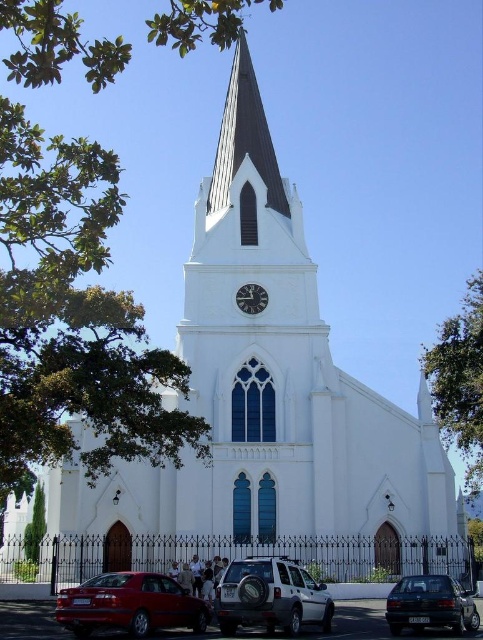
Based on the photo, you are standing at the shiny red sedan at lower left and want to walk directly to the metallic clock face at center. How many steps would you need to take if each step is about 2.5 feet long?

The distance between the shiny red sedan at lower left and the metallic clock face at center is 132.25 feet. Dividing this by the step length of 2.5 feet gives approximately 52.9 steps. Since you can only take whole steps, you would need to take about 53 steps to reach the metallic clock face at center.

You are standing in front of the church and want to take a photo of the metallic clock face at center without the dark gray metallic sedan at lower right blocking the view. Is the sedan between you and the clock face?

The dark gray metallic sedan at lower right is closer to the viewer than metallic clock face at center, so the sedan is between you and the clock face, blocking the view.